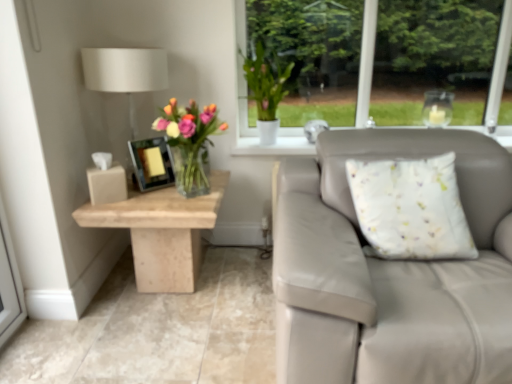
You are a GUI agent. You are given a task and a screenshot of the screen. Output one action in this format:
    pyautogui.click(x=<x>, y=<y>)
    Task: Click on the free space in front of matte black picture frame at center
    
    Given the screenshot: What is the action you would take?
    pyautogui.click(x=148, y=199)